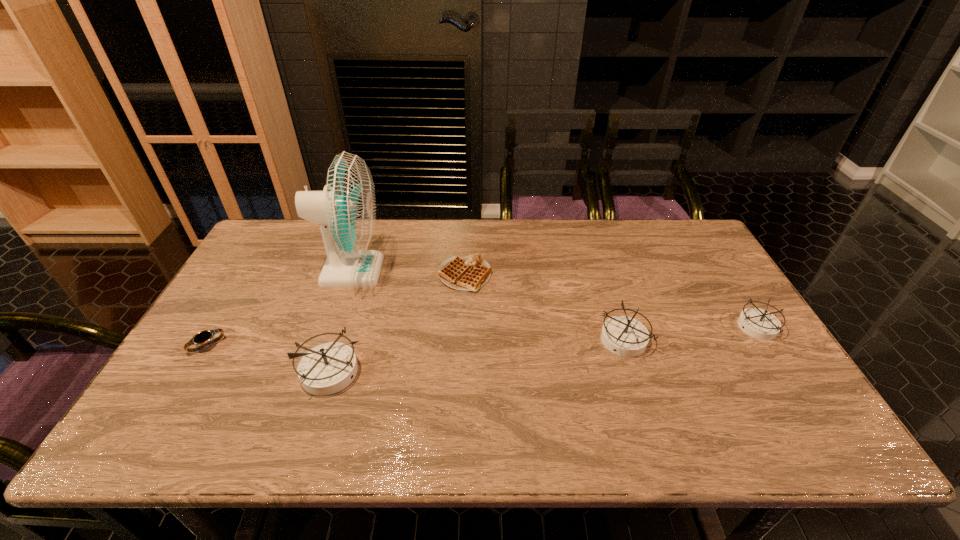
Identify the location of free space at the near edge of the desktop. Image resolution: width=960 pixels, height=540 pixels. (252, 399).

You are a GUI agent. You are given a task and a screenshot of the screen. Output one action in this format:
    pyautogui.click(x=<x>, y=<y>)
    Task: Click on the vacant area at the left edge
    
    Given the screenshot: What is the action you would take?
    pyautogui.click(x=271, y=295)

The image size is (960, 540). In the image, there is a desktop. What are the coordinates of `vacant region at the right edge` in the screenshot? It's located at (725, 286).

Find the location of `free region at the far left corner of the desktop`. free region at the far left corner of the desktop is located at coordinates (275, 253).

Identify the location of vacant space at the far right corner of the desktop. (675, 238).

Locate an element on the screen. Image resolution: width=960 pixels, height=540 pixels. free spot at the near right corner of the desktop is located at coordinates (769, 405).

Where is `unoccupied area between the fan and the leftmost object`? The width and height of the screenshot is (960, 540). unoccupied area between the fan and the leftmost object is located at coordinates (279, 308).

The image size is (960, 540). Find the location of `empty space between the tallest object and the second compass from left to right`. empty space between the tallest object and the second compass from left to right is located at coordinates (488, 306).

I want to click on free space that is in between the watch and the second tallest compass, so click(416, 343).

This screenshot has height=540, width=960. What are the coordinates of `free point between the waffle and the leftmost compass` in the screenshot? It's located at (397, 322).